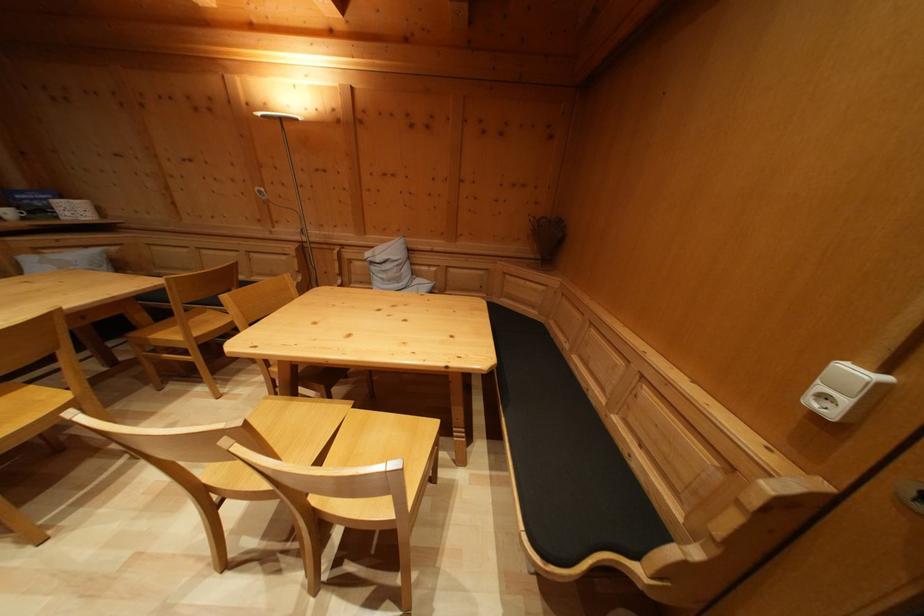
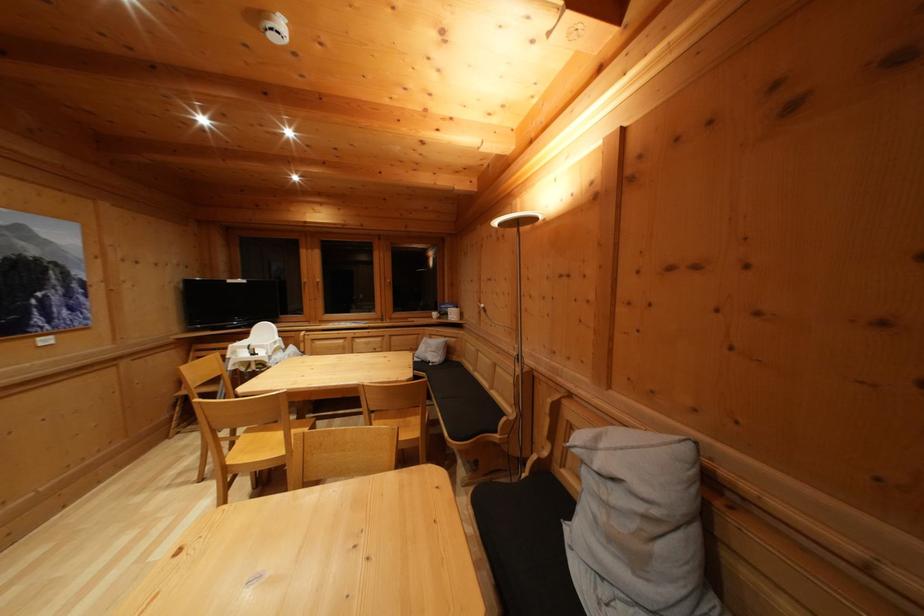
Where in the second image is the point corresponding to point (27, 199) from the first image?

(450, 310)